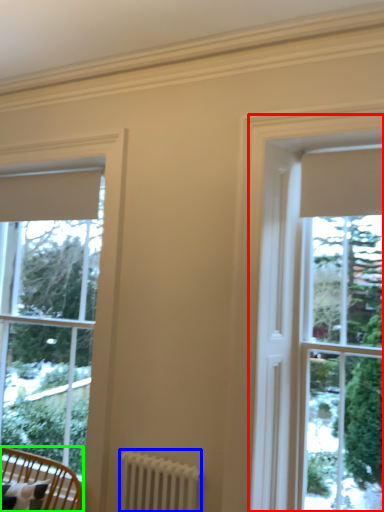
Question: Considering the real-world distances, which object is farthest from bay window (highlighted by a red box)? radiator (highlighted by a blue box) or furniture (highlighted by a green box)?

Choices:
 (A) radiator
 (B) furniture

Answer: (B)